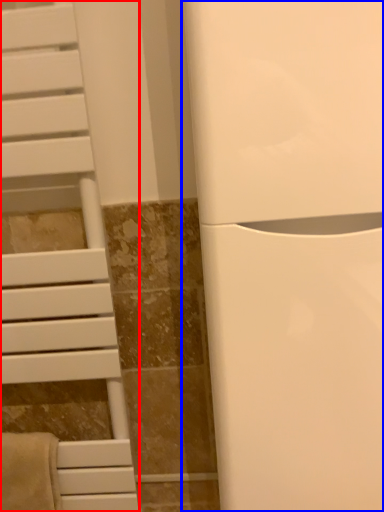
Question: Which point is further to the camera, furniture (highlighted by a red box) or appliance (highlighted by a blue box)?

Choices:
 (A) furniture
 (B) appliance

Answer: (A)